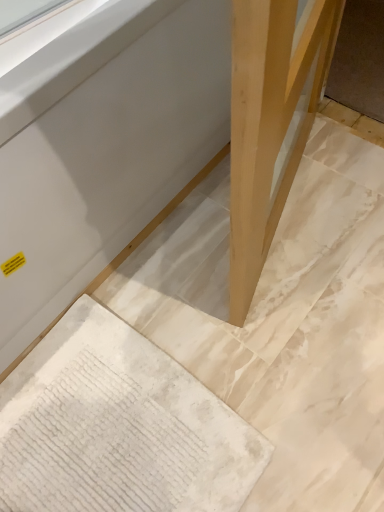
Question: From the image's perspective, is white textured rug at lower left below natural wood leg at center?

Choices:
 (A) no
 (B) yes

Answer: (B)

Question: Is white textured rug at lower left thinner than natural wood leg at center?

Choices:
 (A) no
 (B) yes

Answer: (A)

Question: Could you tell me if white textured rug at lower left is turned towards natural wood leg at center?

Choices:
 (A) no
 (B) yes

Answer: (A)

Question: Considering the relative positions of white textured rug at lower left and natural wood leg at center in the image provided, is white textured rug at lower left to the left of natural wood leg at center from the viewer's perspective?

Choices:
 (A) yes
 (B) no

Answer: (A)

Question: From the image's perspective, is white textured rug at lower left above natural wood leg at center?

Choices:
 (A) no
 (B) yes

Answer: (A)

Question: From a real-world perspective, relative to matte wood table at center, is natural wood leg at center vertically above or below?

Choices:
 (A) below
 (B) above

Answer: (A)

Question: Considering the positions of natural wood leg at center and matte wood table at center in the image, is natural wood leg at center wider or thinner than matte wood table at center?

Choices:
 (A) wide
 (B) thin

Answer: (B)

Question: From the image's perspective, is natural wood leg at center positioned above or below matte wood table at center?

Choices:
 (A) below
 (B) above

Answer: (A)

Question: Based on their sizes in the image, would you say natural wood leg at center is bigger or smaller than matte wood table at center?

Choices:
 (A) big
 (B) small

Answer: (B)

Question: From the image's perspective, relative to natural wood leg at center, is white textured rug at lower left above or below?

Choices:
 (A) below
 (B) above

Answer: (A)

Question: Is white textured rug at lower left to the left or to the right of natural wood leg at center in the image?

Choices:
 (A) left
 (B) right

Answer: (A)

Question: In the image, is white textured rug at lower left positioned in front of or behind natural wood leg at center?

Choices:
 (A) behind
 (B) front

Answer: (A)

Question: From a real-world perspective, is white textured rug at lower left above or below natural wood leg at center?

Choices:
 (A) below
 (B) above

Answer: (A)

Question: In terms of size, does matte wood table at center appear bigger or smaller than white textured rug at lower left?

Choices:
 (A) big
 (B) small

Answer: (A)

Question: Relative to white textured rug at lower left, is matte wood table at center in front or behind?

Choices:
 (A) front
 (B) behind

Answer: (A)